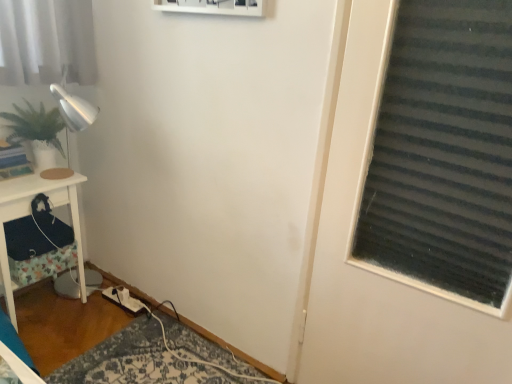
What are the coordinates of `green matte plant at left` in the screenshot? It's located at (37, 132).

What do you see at coordinates (30, 213) in the screenshot? I see `white wood side table at left` at bounding box center [30, 213].

Find the location of a particular element. This screenshot has height=384, width=512. green matte plant at left is located at coordinates (37, 132).

Are white wood side table at left and green matte plant at left far apart?

No.

Looking at this image, from the image's perspective, is white wood side table at left over green matte plant at left?

No.

Considering the relative sizes of white wood side table at left and green matte plant at left in the image provided, is white wood side table at left smaller than green matte plant at left?

No.

Would you say white fabric extension cord at lower left is outside white wood side table at left?

Yes, white fabric extension cord at lower left is located beyond the bounds of white wood side table at left.

How many degrees apart are the facing directions of white fabric extension cord at lower left and white wood side table at left?

white fabric extension cord at lower left and white wood side table at left are facing 4.49 degrees away from each other.

Which object is closer to the camera taking this photo, white fabric extension cord at lower left or white wood side table at left?

white wood side table at left.

Which is behind, point (114, 302) or point (4, 285)?

The point (114, 302) is farther.

Can you confirm if white wood side table at left is shorter than white fabric extension cord at lower left?

Incorrect, the height of white wood side table at left does not fall short of that of white fabric extension cord at lower left.

Looking at this image, is white wood side table at left wider or thinner than white fabric extension cord at lower left?

Clearly, white wood side table at left has more width compared to white fabric extension cord at lower left.

Considering the relative positions of white wood side table at left and white fabric extension cord at lower left in the image provided, is white wood side table at left to the right of white fabric extension cord at lower left from the viewer's perspective?

No, white wood side table at left is not to the right of white fabric extension cord at lower left.

Is white wood side table at left oriented away from white fabric extension cord at lower left?

white wood side table at left is not turned away from white fabric extension cord at lower left.

Between green matte plant at left and white wood side table at left, which one has smaller width?

With smaller width is green matte plant at left.

Who is smaller, green matte plant at left or white wood side table at left?

green matte plant at left is smaller.

From the picture: From a real-world perspective, who is located higher, green matte plant at left or white wood side table at left?

green matte plant at left is physically above.

Is green matte plant at left not near white wood side table at left?

green matte plant at left is actually quite close to white wood side table at left.

Between point (32, 128) and point (113, 295), which one is positioned behind?

The point (113, 295) is behind.

I want to click on extension cord on the right of green matte plant at left, so click(124, 300).

Is green matte plant at left facing away from white fabric extension cord at lower left?

green matte plant at left is not turned away from white fabric extension cord at lower left.

Is green matte plant at left smaller than white fabric extension cord at lower left?

No.

Could you tell me if white fabric extension cord at lower left is facing green matte plant at left?

No, white fabric extension cord at lower left does not turn towards green matte plant at left.

Considering the positions of points (139, 306) and (30, 115), is point (139, 306) farther from camera compared to point (30, 115)?

Yes, point (139, 306) is behind point (30, 115).

Between white fabric extension cord at lower left and green matte plant at left, which one is positioned in front?

green matte plant at left.

Find the location of a particular element. furniture located below the green matte plant at left (from the image's perspective) is located at coordinates (30, 213).

What are the coordinates of `furniture above the white fabric extension cord at lower left (from a real-world perspective)` in the screenshot? It's located at (30, 213).

Considering their positions, is white wood side table at left positioned further to white fabric extension cord at lower left than green matte plant at left?

green matte plant at left lies further to white fabric extension cord at lower left than the other object.

In the scene shown: Estimate the real-world distances between objects in this image. Which object is closer to green matte plant at left, white wood side table at left or white fabric extension cord at lower left?

Among the two, white wood side table at left is located nearer to green matte plant at left.

Based on their spatial positions, is green matte plant at left or white fabric extension cord at lower left closer to white wood side table at left?

green matte plant at left is closer to white wood side table at left.

When comparing their distances from green matte plant at left, does white fabric extension cord at lower left or white wood side table at left seem further?

The object further to green matte plant at left is white fabric extension cord at lower left.

Looking at the image, which one is located closer to white wood side table at left, white fabric extension cord at lower left or green matte plant at left?

green matte plant at left.

When comparing their distances from white fabric extension cord at lower left, does green matte plant at left or white wood side table at left seem closer?

Among the two, white wood side table at left is located nearer to white fabric extension cord at lower left.

Where is `furniture between green matte plant at left and white fabric extension cord at lower left in the vertical direction`? furniture between green matte plant at left and white fabric extension cord at lower left in the vertical direction is located at coordinates (30, 213).